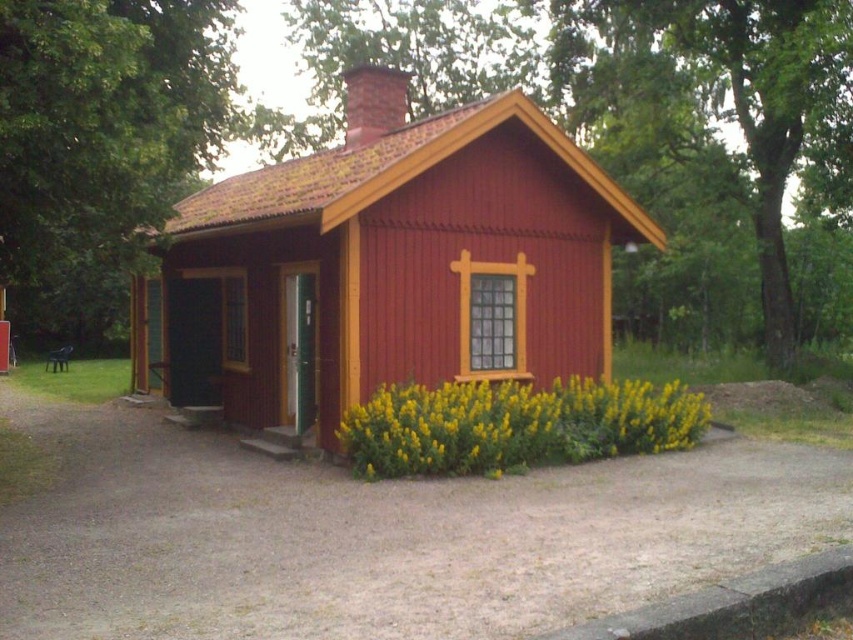
Is matte red wooden cabin at center positioned in front of yellow matte flowers at lower center?

No, it is not.

This screenshot has height=640, width=853. Describe the element at coordinates (387, 266) in the screenshot. I see `matte red wooden cabin at center` at that location.

What are the coordinates of `matte red wooden cabin at center` in the screenshot? It's located at (387, 266).